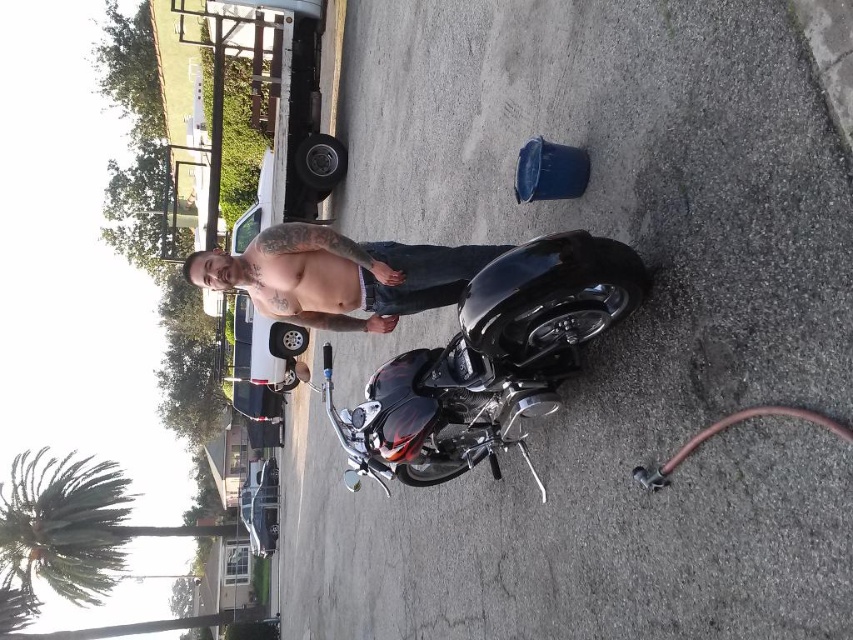
You are a photographer holding a camera 1.5 meters tall. You want to take a photo of the glossy black motorcycle at center. Considering the height of your camera and the distance between you and the motorcycle, will the camera be able to capture the motorcycle in the frame without needing to adjust its position?

The glossy black motorcycle at center and camera are 1.98 meters apart from each other. Since the camera is only 1.5 meters tall, the distance between them is greater than the camera height. Therefore, the camera might not be able to capture the motorcycle in the frame without adjusting its position for proper framing.